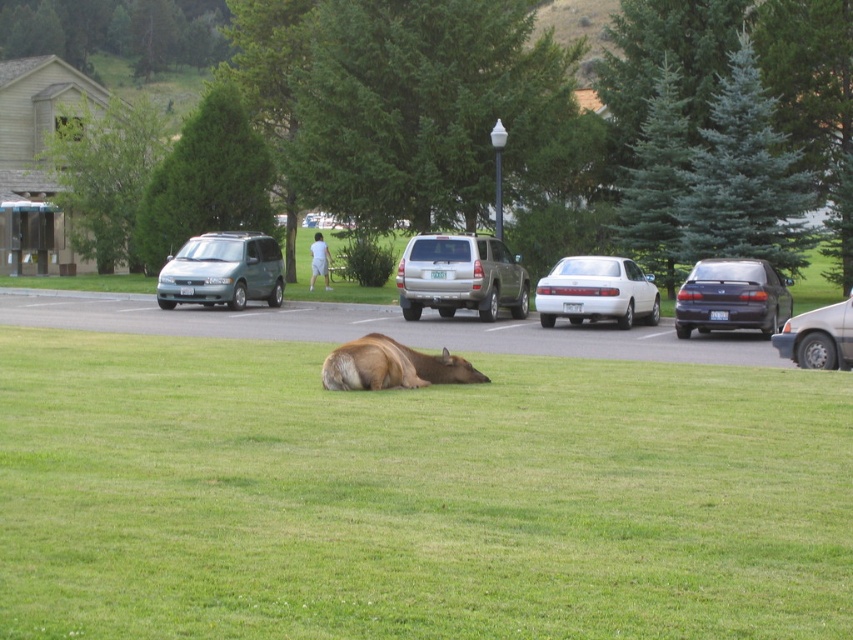
You are a visitor at the park and want to park your car. You see the teal matte minivan at center and the matte black sedan at right. Which one is smaller?

The teal matte minivan at center is smaller than the matte black sedan at right.

You are a photographer trying to capture a clear shot of the gold metallic suv at center and the matte black sedan at right. Based on their positions, which vehicle should you focus on first to ensure it appears in the foreground of your photo?

The gold metallic suv at center is located above the matte black sedan at right, so focusing on the gold metallic suv at center first will ensure it appears in the foreground since it is positioned higher in the frame.